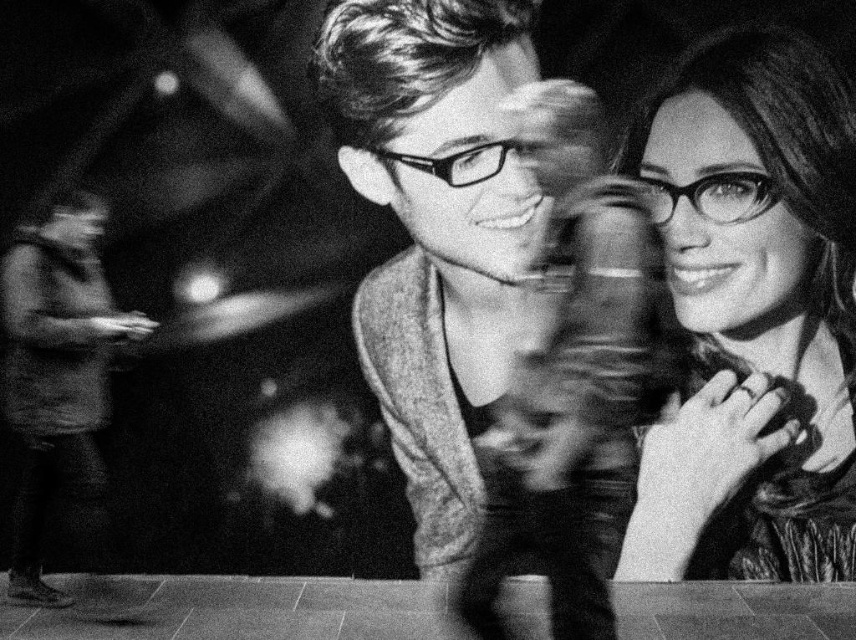
Between point (468, 17) and point (19, 378), which one is positioned behind?

The point (19, 378) is more distant.

What do you see at coordinates (752, 317) in the screenshot? The image size is (856, 640). I see `smooth leather jacket at center` at bounding box center [752, 317].

The image size is (856, 640). What do you see at coordinates (752, 317) in the screenshot? I see `smooth leather jacket at center` at bounding box center [752, 317].

At what (x,y) coordinates should I click in order to perform the action: click on smooth leather jacket at center. Please return your answer as a coordinate pair (x, y). This screenshot has height=640, width=856. Looking at the image, I should click on (752, 317).

Who is positioned more to the left, smooth leather jacket at center or matte black glasses at upper right?

smooth leather jacket at center is more to the left.

Between point (682, 307) and point (727, 120), which one is positioned behind?

The point (682, 307) is more distant.

In order to click on smooth leather jacket at center in this screenshot , I will do coord(752,317).

Between matte black glasses at upper right and smooth fabric shirt at lower left, which one is positioned higher?

Positioned higher is matte black glasses at upper right.

Does matte black glasses at upper right appear under smooth fabric shirt at lower left?

No, matte black glasses at upper right is not below smooth fabric shirt at lower left.

What do you see at coordinates (752, 314) in the screenshot?
I see `matte black glasses at upper right` at bounding box center [752, 314].

The image size is (856, 640). Find the location of `matte black glasses at upper right`. matte black glasses at upper right is located at coordinates (752, 314).